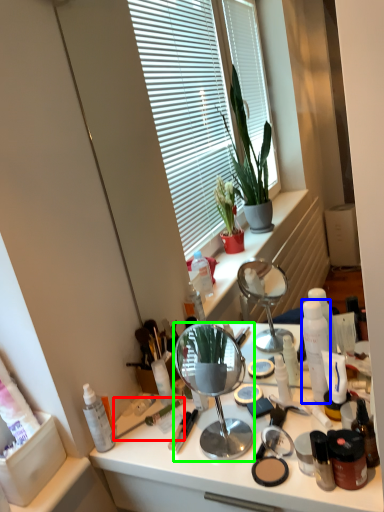
Question: Estimate the real-world distances between objects in this image. Which object is farther from paint brush (highlighted by a red box), toiletry (highlighted by a blue box) or mirror (highlighted by a green box)?

Choices:
 (A) toiletry
 (B) mirror

Answer: (A)